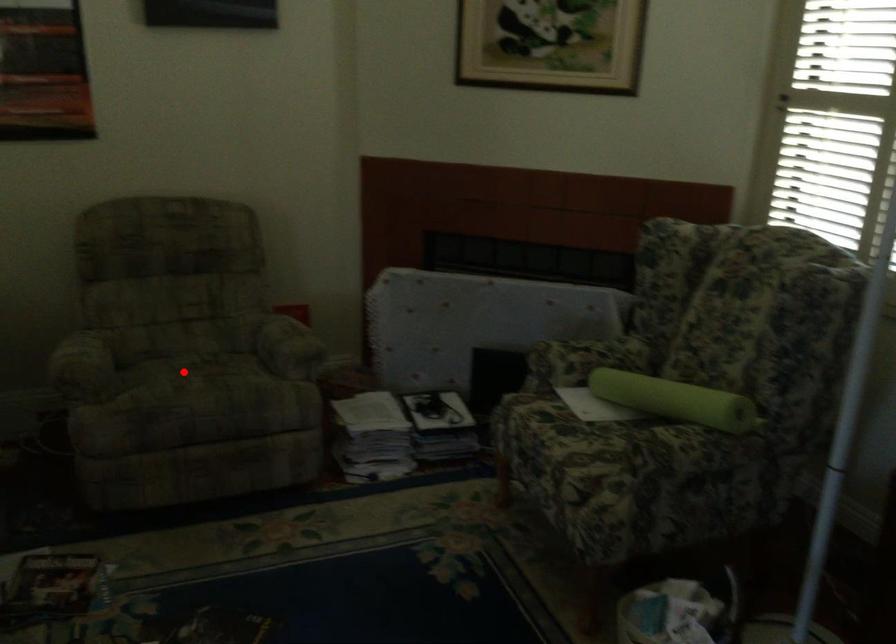
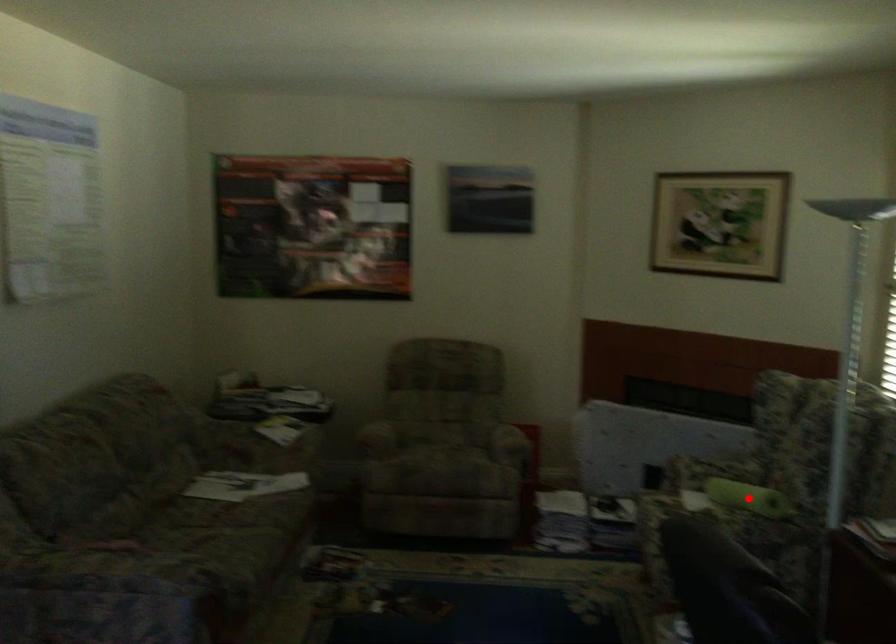
I am providing you with two images of the same scene from different viewpoints. A red point is marked on the first image and another point is marked on the second image. Does the point marked in image1 correspond to the same location as the one in image2?

No